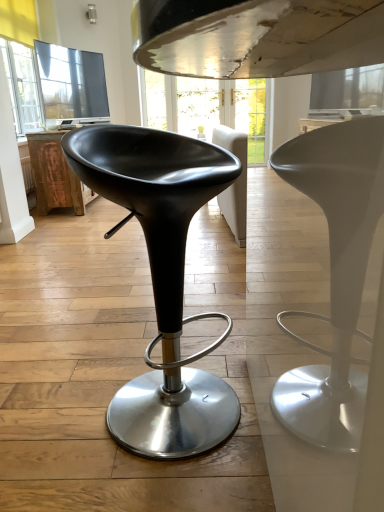
The width and height of the screenshot is (384, 512). Find the location of `rustic wood table at left`. rustic wood table at left is located at coordinates (55, 175).

The height and width of the screenshot is (512, 384). Describe the element at coordinates (55, 175) in the screenshot. I see `rustic wood table at left` at that location.

This screenshot has height=512, width=384. Find the location of `black leather stool at center`. black leather stool at center is located at coordinates (162, 280).

Describe the element at coordinates (162, 280) in the screenshot. I see `black leather stool at center` at that location.

Measure the distance between black leather stool at center and camera.

A distance of 31.42 inches exists between black leather stool at center and camera.

In order to face black leather stool at center, should I rotate leftwards or rightwards?

To face it directly, rotate left by 3.704 degrees.

This screenshot has width=384, height=512. I want to click on rustic wood table at left, so click(x=55, y=175).

Which is more to the right, rustic wood table at left or black leather stool at center?

From the viewer's perspective, black leather stool at center appears more on the right side.

Does rustic wood table at left come in front of black leather stool at center?

No, rustic wood table at left is further to the viewer.

Which is behind, point (42, 137) or point (114, 178)?

Point (42, 137)

From the image's perspective, is rustic wood table at left over black leather stool at center?

Indeed, from the image's perspective, rustic wood table at left is shown above black leather stool at center.

From a real-world perspective, which object stands above the other?

black leather stool at center.

Considering the relative sizes of rustic wood table at left and black leather stool at center in the image provided, is rustic wood table at left thinner than black leather stool at center?

No, rustic wood table at left is not thinner than black leather stool at center.

Does rustic wood table at left have a lesser height compared to black leather stool at center?

Correct, rustic wood table at left is not as tall as black leather stool at center.

In terms of size, does rustic wood table at left appear bigger or smaller than black leather stool at center?

In the image, rustic wood table at left appears to be larger than black leather stool at center.

Does rustic wood table at left contain black leather stool at center?

That's incorrect, black leather stool at center is not inside rustic wood table at left.

Is rustic wood table at left not close to black leather stool at center?

Yes, rustic wood table at left and black leather stool at center are located far from each other.

Based on the photo, could you tell me if rustic wood table at left is turned towards black leather stool at center?

No, rustic wood table at left is not facing towards black leather stool at center.

Can you tell me how much rustic wood table at left and black leather stool at center differ in facing direction?

37 degrees.

Based on the photo, how distant is rustic wood table at left from black leather stool at center?

The distance of rustic wood table at left from black leather stool at center is 7.95 feet.

The height and width of the screenshot is (512, 384). What are the coordinates of `chair that appears below the rustic wood table at left (from the image's perspective)` in the screenshot? It's located at (162, 280).

Which object is positioned more to the right, black leather stool at center or rustic wood table at left?

black leather stool at center is more to the right.

Which object is closer to the camera, black leather stool at center or rustic wood table at left?

black leather stool at center is more forward.

Is point (118, 149) positioned after point (47, 182)?

No, (118, 149) is closer to viewer.

From the image's perspective, which is below, black leather stool at center or rustic wood table at left?

black leather stool at center appears lower in the image.

From a real-world perspective, is black leather stool at center located higher than rustic wood table at left?

Yes, from a real-world perspective, black leather stool at center is above rustic wood table at left.

In terms of width, does black leather stool at center look wider or thinner when compared to rustic wood table at left?

Clearly, black leather stool at center has less width compared to rustic wood table at left.

Which of these two, black leather stool at center or rustic wood table at left, stands shorter?

Standing shorter between the two is rustic wood table at left.

Considering the sizes of objects black leather stool at center and rustic wood table at left in the image provided, who is smaller, black leather stool at center or rustic wood table at left?

black leather stool at center.

Would you say rustic wood table at left is part of black leather stool at center's contents?

Actually, rustic wood table at left is outside black leather stool at center.

Does black leather stool at center touch rustic wood table at left?

There is a gap between black leather stool at center and rustic wood table at left.

Is black leather stool at center looking in the opposite direction of rustic wood table at left?

No, black leather stool at center is not facing away from rustic wood table at left.

Can you tell me how much black leather stool at center and rustic wood table at left differ in facing direction?

The facing directions of black leather stool at center and rustic wood table at left are 37 degrees apart.

How distant is black leather stool at center from rustic wood table at left?

black leather stool at center and rustic wood table at left are 7.95 feet apart.

Identify the location of table below the black leather stool at center (from a real-world perspective). The image size is (384, 512). (55, 175).

In the image, there is a black leather stool at center. Identify the location of table above it (from the image's perspective). The height and width of the screenshot is (512, 384). [x=55, y=175].

Image resolution: width=384 pixels, height=512 pixels. What are the coordinates of `chair above the rustic wood table at left (from a real-world perspective)` in the screenshot? It's located at (162, 280).